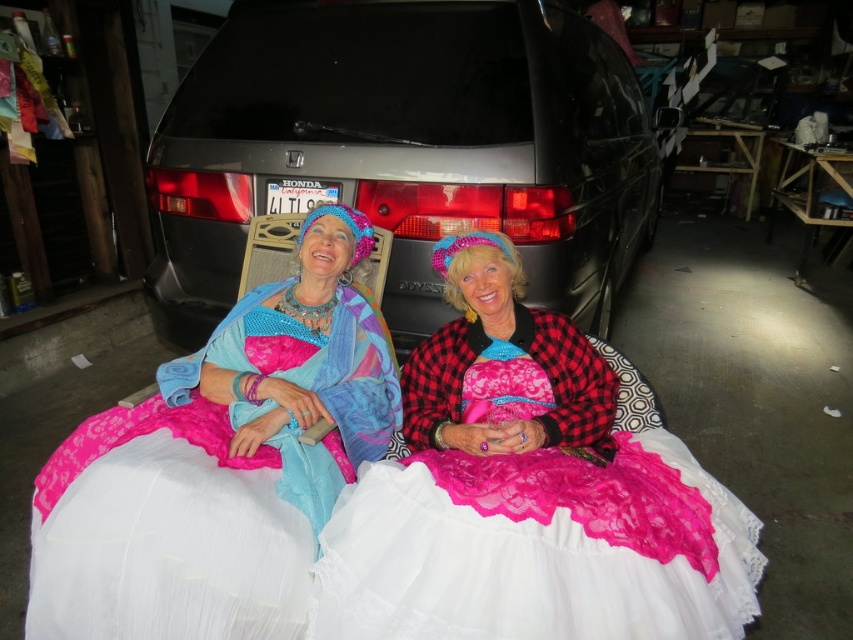
Can you confirm if black plastic van at center is positioned to the left of lace fabric dress at center?

Incorrect, black plastic van at center is not on the left side of lace fabric dress at center.

Is black plastic van at center further to camera compared to lace fabric dress at center?

Yes, it is behind lace fabric dress at center.

This screenshot has height=640, width=853. Describe the element at coordinates (404, 148) in the screenshot. I see `black plastic van at center` at that location.

Locate an element on the screen. black plastic van at center is located at coordinates (404, 148).

The width and height of the screenshot is (853, 640). Describe the element at coordinates (404, 148) in the screenshot. I see `black plastic van at center` at that location.

Is the position of black plastic van at center less distant than that of pink lace dress at center?

That is False.

This screenshot has height=640, width=853. Identify the location of black plastic van at center. (404, 148).

Is pink lace dress at center smaller than lace fabric dress at center?

Incorrect, pink lace dress at center is not smaller in size than lace fabric dress at center.

Does point (466, 634) come farther from viewer compared to point (247, 541)?

No.

Find the location of a particular element. This screenshot has height=640, width=853. pink lace dress at center is located at coordinates (527, 493).

Locate an element on the screen. Image resolution: width=853 pixels, height=640 pixels. pink lace dress at center is located at coordinates (527, 493).